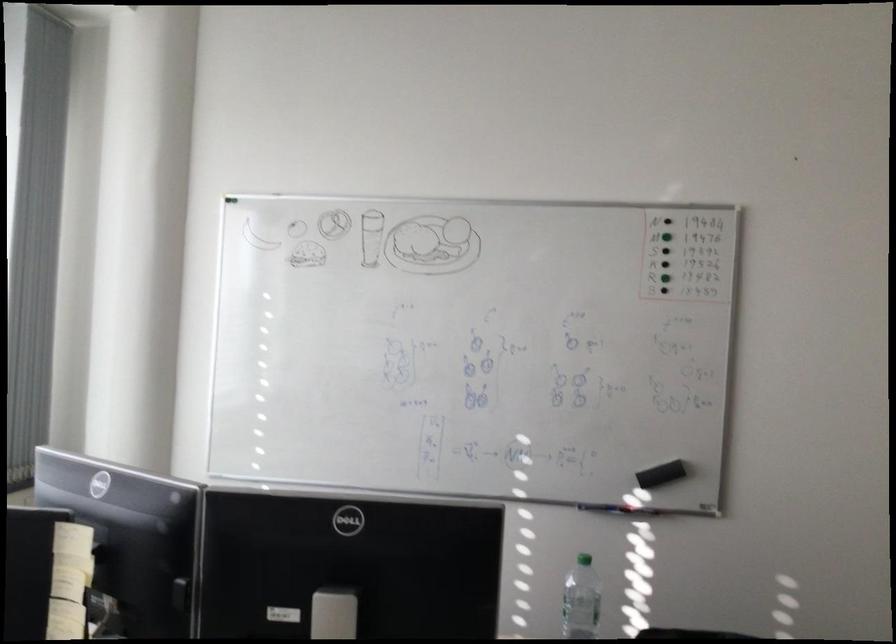
Find the location of a particular element. plastic water bottle is located at coordinates (581, 600).